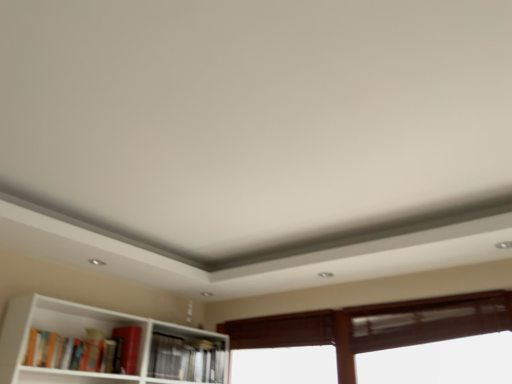
Where is `brown wooden window at lower right`? The height and width of the screenshot is (384, 512). brown wooden window at lower right is located at coordinates (376, 326).

From a real-world perspective, which object rests below the other?

hardcover book at lower left, the 2th book viewed from the back, from a real-world perspective.

Does hardcover book at lower left, the 2th book viewed from the back, have a smaller size compared to brown wooden window at lower right?

Yes, hardcover book at lower left, the 2th book viewed from the back, is smaller than brown wooden window at lower right.

The width and height of the screenshot is (512, 384). Find the location of `window above the hardcover book at lower left, which is the 1th book from front to back (from a real-world perspective)`. window above the hardcover book at lower left, which is the 1th book from front to back (from a real-world perspective) is located at coordinates (376, 326).

Does hardcover book at lower left, the 2th book viewed from the back, have a lesser height compared to brown wooden window at lower right?

Yes, hardcover book at lower left, the 2th book viewed from the back, is shorter than brown wooden window at lower right.

From the image's perspective, who appears lower, hardcover book at center, the 1th book positioned from the back, or hardcover book at lower left, the 2th book viewed from the back?

From the image's view, hardcover book at center, the 1th book positioned from the back, is below.

Who is shorter, hardcover book at center, the 1th book positioned from the back, or hardcover book at lower left, the second book viewed from the right?

hardcover book at lower left, the second book viewed from the right, is shorter.

From a real-world perspective, is hardcover book at center, the 2th book from the front, positioned above or below hardcover book at lower left, the 2th book viewed from the back?

In terms of real-world spatial position, hardcover book at center, the 2th book from the front, is below hardcover book at lower left, the 2th book viewed from the back.

How much distance is there between hardcover book at center, acting as the 1th book starting from the right, and hardcover book at lower left, which is the first book in left-to-right order?

hardcover book at center, acting as the 1th book starting from the right, and hardcover book at lower left, which is the first book in left-to-right order, are 41.44 centimeters apart.

Can you confirm if hardcover book at center, the 2th book from the front, is taller than brown wooden window at lower right?

Incorrect, the height of hardcover book at center, the 2th book from the front, is not larger of that of brown wooden window at lower right.

Could you tell me if hardcover book at center, acting as the 1th book starting from the right, is facing brown wooden window at lower right?

Yes.

From the picture: From the image's perspective, which object appears higher, hardcover book at center, the 2th book from the front, or brown wooden window at lower right?

brown wooden window at lower right, from the image's perspective.

From the image's perspective, is brown wooden window at lower right positioned above or below hardcover book at lower left, which is the first book in left-to-right order?

Based on their image positions, brown wooden window at lower right is located beneath hardcover book at lower left, which is the first book in left-to-right order.

Does point (396, 326) lie behind point (116, 332)?

Yes, it is behind point (116, 332).

From a real-world perspective, is brown wooden window at lower right below hardcover book at lower left, which is the first book in left-to-right order?

No.

What's the angular difference between brown wooden window at lower right and hardcover book at lower left, which is the first book in left-to-right order,'s facing directions?

The angle between the facing direction of brown wooden window at lower right and the facing direction of hardcover book at lower left, which is the first book in left-to-right order, is 89.2 degrees.

Is brown wooden window at lower right wider than hardcover book at center, the 2th book from the front?

Correct, the width of brown wooden window at lower right exceeds that of hardcover book at center, the 2th book from the front.

From the picture: Could you measure the distance between brown wooden window at lower right and hardcover book at center, the 1th book positioned from the back?

brown wooden window at lower right is 74.76 centimeters from hardcover book at center, the 1th book positioned from the back.

Can you confirm if brown wooden window at lower right is bigger than hardcover book at center, the 2th book from the front?

Yes.

From the image's perspective, is brown wooden window at lower right under hardcover book at center, arranged as the 2th book when viewed from the left?

No, from the image's perspective, brown wooden window at lower right is not beneath hardcover book at center, arranged as the 2th book when viewed from the left.

Do you think hardcover book at lower left, the second book viewed from the right, is within hardcover book at center, the 2th book from the front, or outside of it?

hardcover book at lower left, the second book viewed from the right, is spatially situated outside hardcover book at center, the 2th book from the front.

From the image's perspective, between hardcover book at lower left, the 2th book viewed from the back, and hardcover book at center, the 1th book positioned from the back, which one is located above?

hardcover book at lower left, the 2th book viewed from the back.

From a real-world perspective, which object rests below the other?

From a 3D spatial view, hardcover book at center, acting as the 1th book starting from the right, is below.

What are the coordinates of `book that is on the left side of hardcover book at center, the 1th book positioned from the back` in the screenshot? It's located at (86, 351).

In the image, there is a brown wooden window at lower right. Where is `book above it (from the image's perspective)`? The width and height of the screenshot is (512, 384). book above it (from the image's perspective) is located at coordinates (86, 351).

At what (x,y) coordinates should I click in order to perform the action: click on book on the left of hardcover book at center, the 2th book from the front. Please return your answer as a coordinate pair (x, y). The width and height of the screenshot is (512, 384). Looking at the image, I should click on (86, 351).

Considering their positions, is hardcover book at lower left, which is the first book in left-to-right order, positioned further to hardcover book at center, arranged as the 2th book when viewed from the left, than brown wooden window at lower right?

Among the two, brown wooden window at lower right is located further to hardcover book at center, arranged as the 2th book when viewed from the left.

From the image, which object appears to be nearer to hardcover book at lower left, which is the first book in left-to-right order, hardcover book at center, the 2th book from the front, or brown wooden window at lower right?

hardcover book at center, the 2th book from the front.

When comparing their distances from brown wooden window at lower right, does hardcover book at center, acting as the 1th book starting from the right, or hardcover book at lower left, the second book viewed from the right, seem closer?

Among the two, hardcover book at center, acting as the 1th book starting from the right, is located nearer to brown wooden window at lower right.

From the image, which object appears to be nearer to hardcover book at lower left, which is the 1th book from front to back, brown wooden window at lower right or hardcover book at center, the 2th book from the front?

hardcover book at center, the 2th book from the front.

Estimate the real-world distances between objects in this image. Which object is further from hardcover book at center, the 2th book from the front, brown wooden window at lower right or hardcover book at lower left, the second book viewed from the right?

Among the two, brown wooden window at lower right is located further to hardcover book at center, the 2th book from the front.

Considering their positions, is hardcover book at lower left, the 2th book viewed from the back, positioned further to brown wooden window at lower right than hardcover book at center, the 2th book from the front?

Among the two, hardcover book at lower left, the 2th book viewed from the back, is located further to brown wooden window at lower right.

This screenshot has height=384, width=512. I want to click on book situated between hardcover book at lower left, which is the first book in left-to-right order, and brown wooden window at lower right from left to right, so click(186, 359).